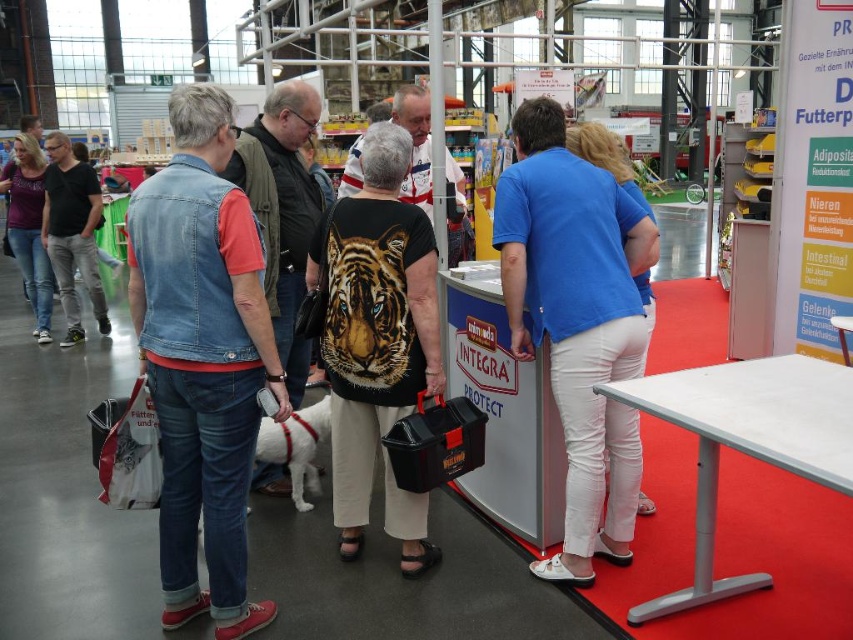
You are at a trade fair and see two people near the booth. The first person is wearing a denim vest at left, and the second is wearing a matte purple shirt at left. Which clothing item is closer to you?

The denim vest at left is closer to you because it is in front of the matte purple shirt at left.